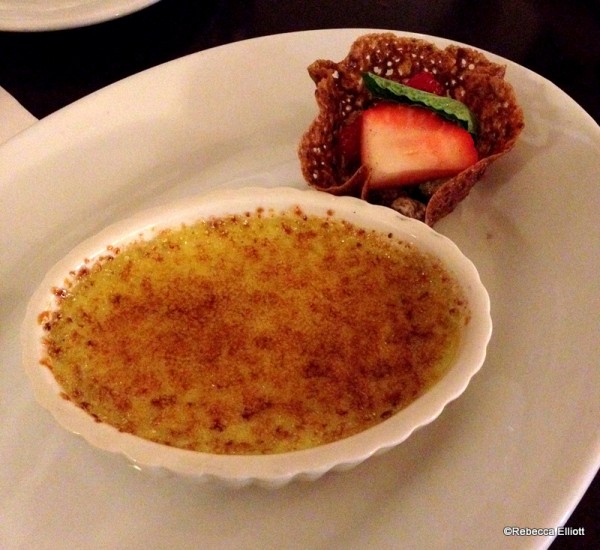
What are the coordinates of `plate` in the screenshot? It's located at (565, 461).